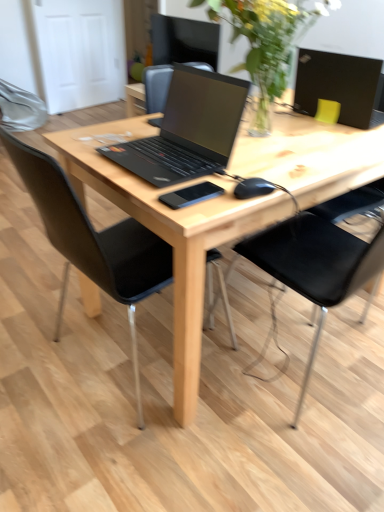
Image resolution: width=384 pixels, height=512 pixels. Find the location of `spots to the right of black matte laptop at center, which is the second laptop in right-to-left order`. spots to the right of black matte laptop at center, which is the second laptop in right-to-left order is located at coordinates (284, 164).